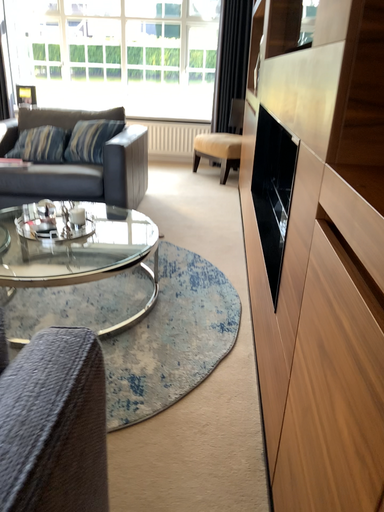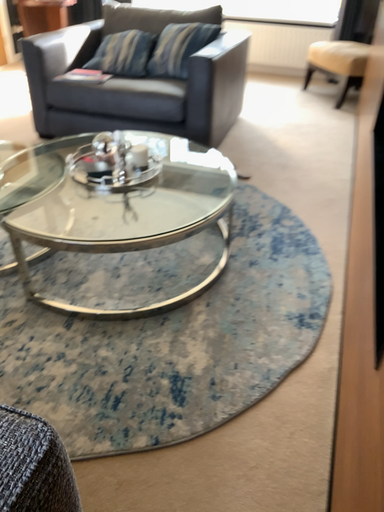
Question: Which way did the camera rotate in the video?

Choices:
 (A) rotated right
 (B) rotated left

Answer: (B)